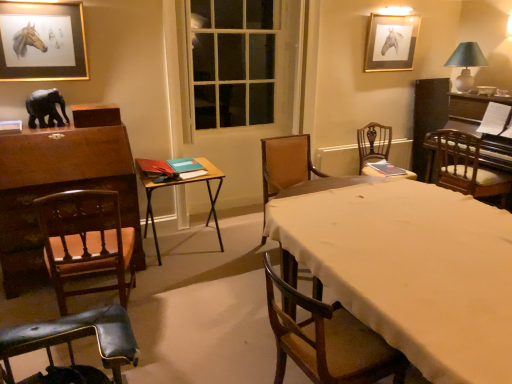
From a real-world perspective, where is a free space above gold-framed painting of horse at upper left, acting as the first picture frame starting from the front? Please provide its 2D coordinates.

[(0.117, -0.001)]